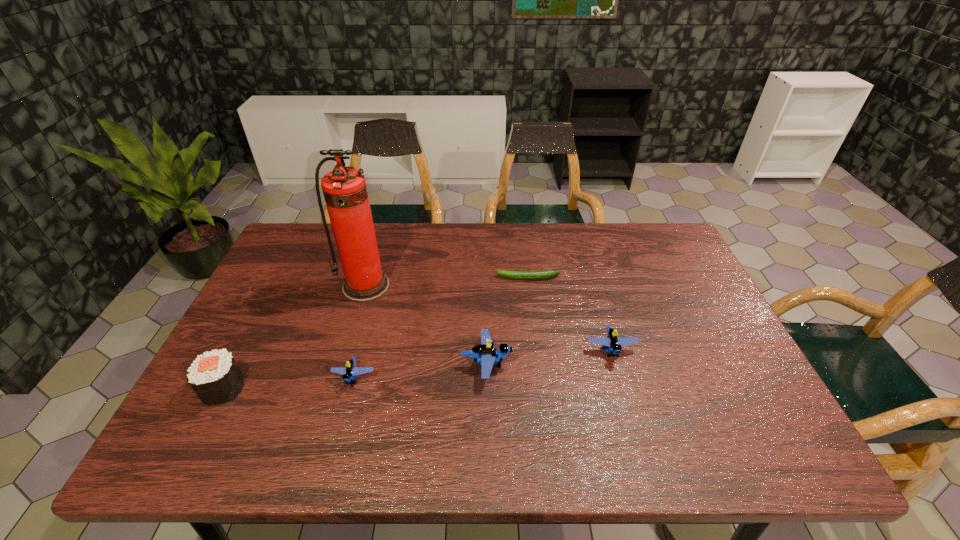
Where is `vacant space that satisfies the following two spatial constraints: 1. on the front-facing side of the rightmost object; 2. on the front-facing side of the tallest Lego`? vacant space that satisfies the following two spatial constraints: 1. on the front-facing side of the rightmost object; 2. on the front-facing side of the tallest Lego is located at coordinates (614, 363).

Image resolution: width=960 pixels, height=540 pixels. I want to click on vacant point that satisfies the following two spatial constraints: 1. on the front-facing side of the tallest Lego; 2. on the front-facing side of the fifth tallest object, so click(x=487, y=377).

Where is `free spot that satisfies the following two spatial constraints: 1. on the front-facing side of the tallest Lego; 2. on the front-facing side of the shortest Lego`? free spot that satisfies the following two spatial constraints: 1. on the front-facing side of the tallest Lego; 2. on the front-facing side of the shortest Lego is located at coordinates (487, 377).